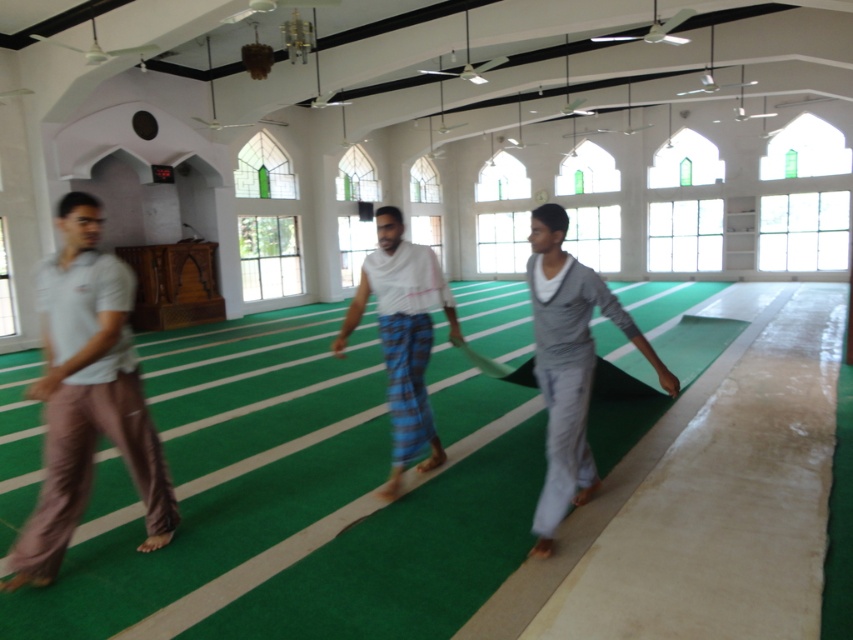
Question: Can you confirm if light brown cotton pants at left is positioned below white woven cloth at center?

Choices:
 (A) yes
 (B) no

Answer: (A)

Question: Which point is farther to the camera?

Choices:
 (A) (569, 406)
 (B) (426, 280)
 (C) (131, 348)

Answer: (B)

Question: Can you confirm if gray cotton pants at center is bigger than white woven cloth at center?

Choices:
 (A) no
 (B) yes

Answer: (A)

Question: Is gray cotton pants at center to the left of white woven cloth at center from the viewer's perspective?

Choices:
 (A) yes
 (B) no

Answer: (B)

Question: Considering the real-world distances, which object is farthest from the gray cotton pants at center?

Choices:
 (A) white woven cloth at center
 (B) light brown cotton pants at left

Answer: (B)

Question: Which object appears closest to the camera in this image?

Choices:
 (A) light brown cotton pants at left
 (B) white woven cloth at center
 (C) gray cotton pants at center

Answer: (A)